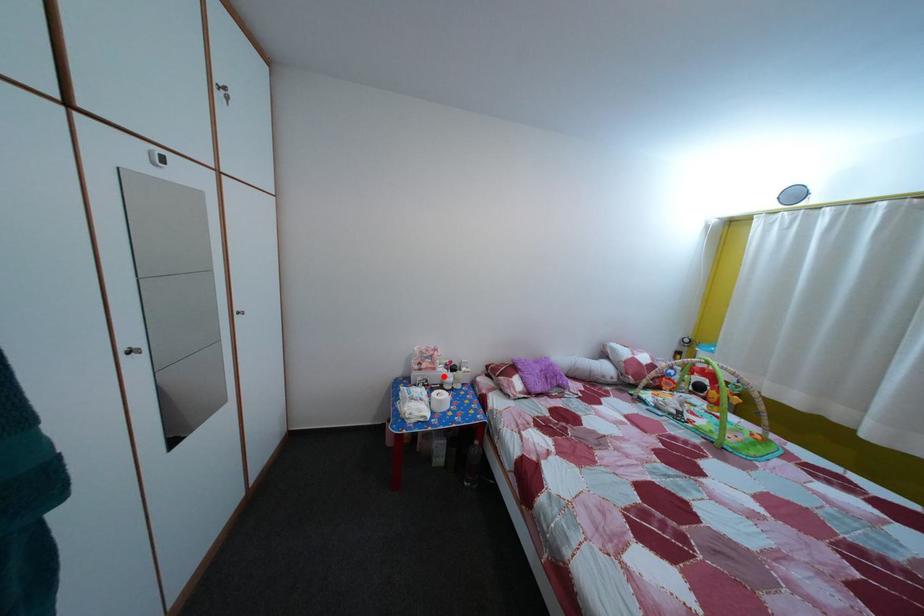
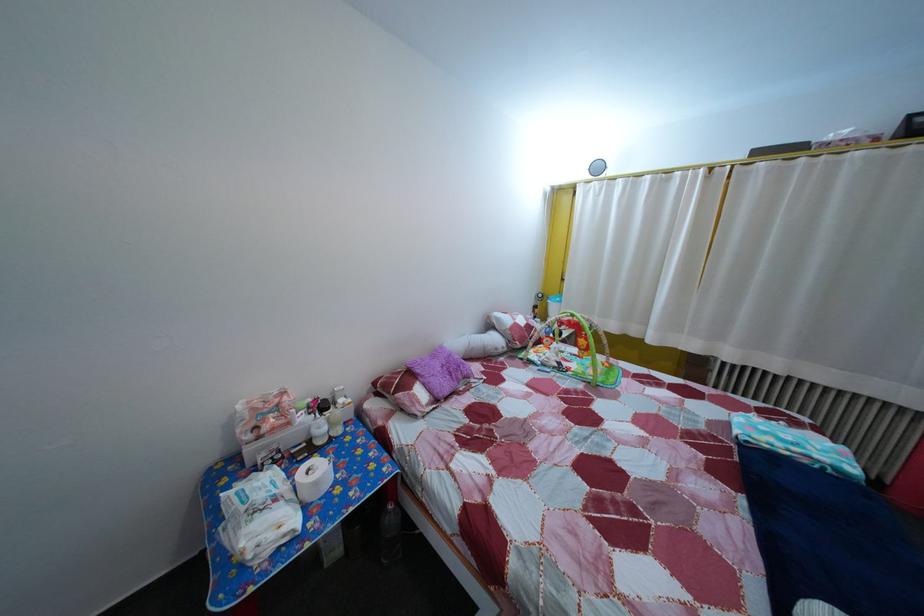
Question: A red point is marked in image1. In image2, is the corresponding 3D point closer to the camera or farther? Reply with the corresponding letter.

Choices:
 (A) The corresponding 3D point is closer.
 (B) The corresponding 3D point is farther.

Answer: (A)